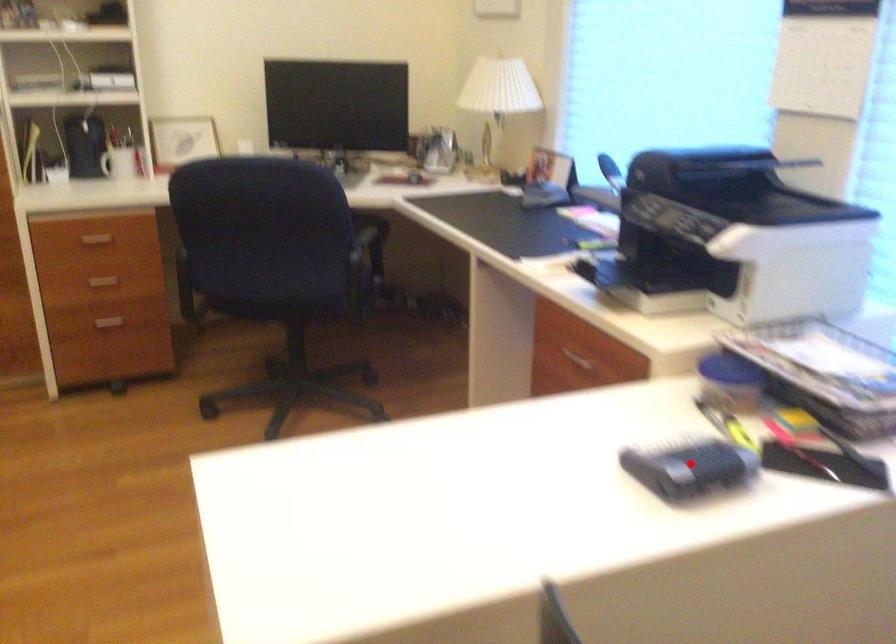
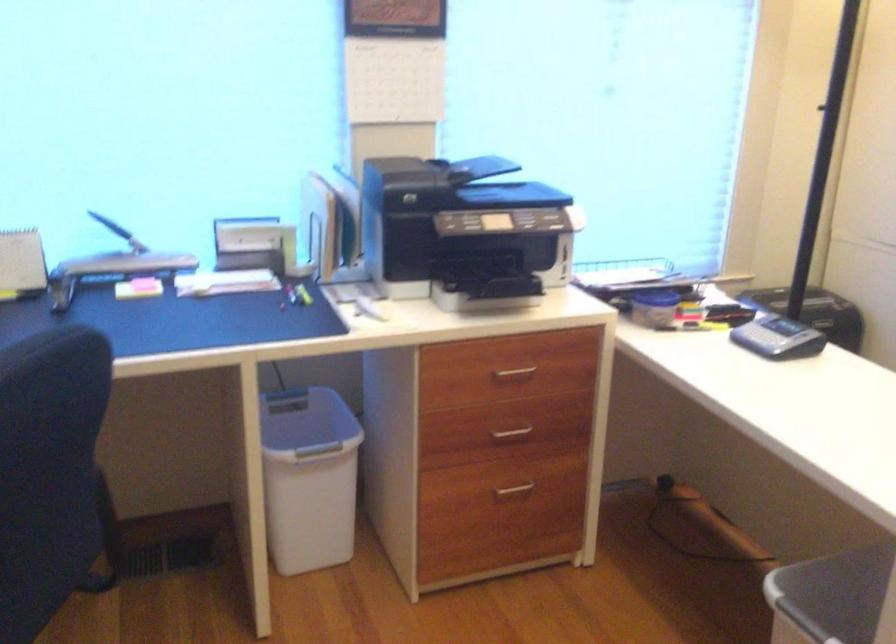
Find the pixel in the second image that matches the highlighted location in the first image.

(778, 337)